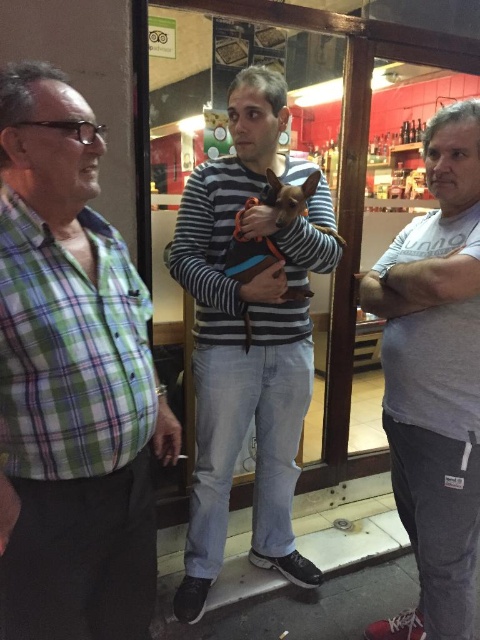
Between striped sweater at center and gray cotton t-shirt at right, which one appears on the left side from the viewer's perspective?

striped sweater at center is more to the left.

Is striped sweater at center shorter than gray cotton t-shirt at right?

In fact, striped sweater at center may be taller than gray cotton t-shirt at right.

Is point (280, 406) in front of point (396, 321)?

No, it is not.

Image resolution: width=480 pixels, height=640 pixels. In order to click on striped sweater at center in this screenshot , I will do `click(248, 339)`.

Does skinny jeans at center lie in front of brown fabric dog at center?

That is True.

How far apart are skinny jeans at center and brown fabric dog at center?

skinny jeans at center and brown fabric dog at center are 12.46 inches apart.

I want to click on skinny jeans at center, so click(x=420, y=280).

Does gray cotton t-shirt at right have a smaller size compared to brown fabric dog at center?

No.

Which is below, gray cotton t-shirt at right or brown fabric dog at center?

gray cotton t-shirt at right is below.

Is point (423, 536) in front of point (288, 292)?

That is True.

This screenshot has width=480, height=640. I want to click on gray cotton t-shirt at right, so click(434, 380).